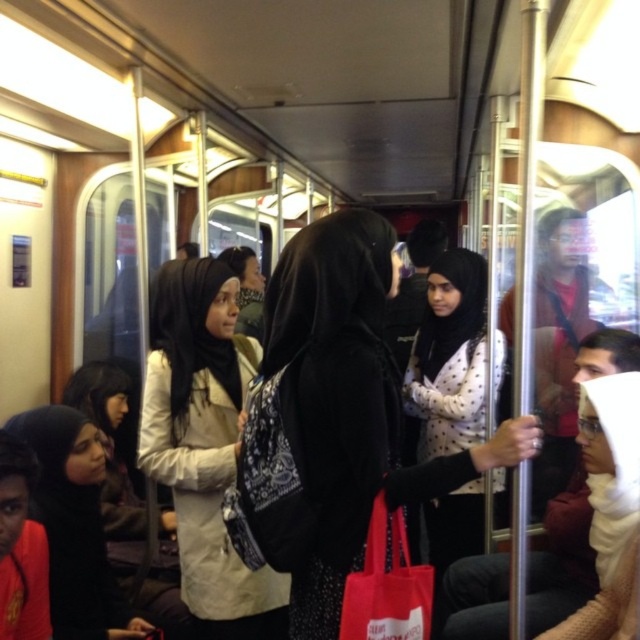
You are a passenger on a train and want to know which hijab is nearer to you. You see the beige fabric hijab at center and the black fabric hijab at lower left. Which one is closer to you?

The beige fabric hijab at center is closer to the viewer than the black fabric hijab at lower left.